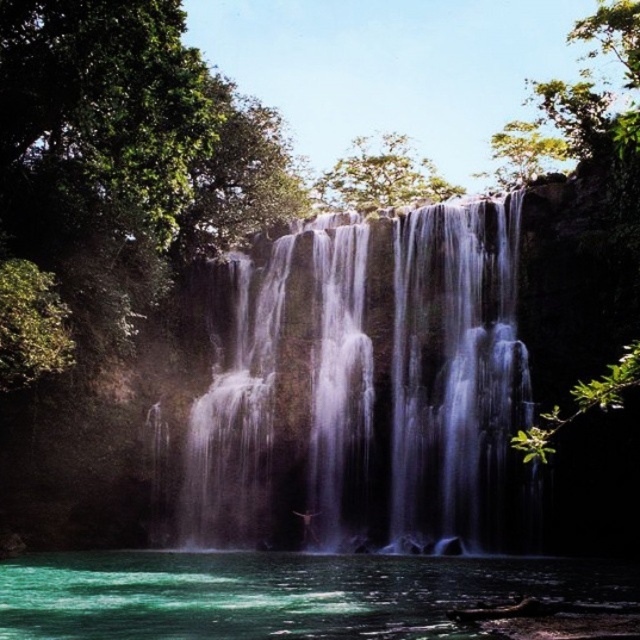
Describe the element at coordinates (358, 394) in the screenshot. I see `white silky waterfall at center` at that location.

Is point (317, 490) positioned behind point (129, 554)?

That is True.

I want to click on white silky waterfall at center, so click(x=358, y=394).

The width and height of the screenshot is (640, 640). What are the coordinates of `white silky waterfall at center` in the screenshot? It's located at (358, 394).

Is green translucent water at lower center below green leafy tree at upper right?

Yes, green translucent water at lower center is below green leafy tree at upper right.

Which is behind, point (250, 560) or point (547, 442)?

The point (250, 560) is more distant.

The height and width of the screenshot is (640, 640). What are the coordinates of `green translucent water at lower center` in the screenshot? It's located at (300, 595).

Where is `green translucent water at lower center`? Image resolution: width=640 pixels, height=640 pixels. green translucent water at lower center is located at coordinates (300, 595).

Does white silky waterfall at center have a greater height compared to green leafy tree at upper right?

No.

Is white silky waterfall at center bigger than green leafy tree at upper right?

No, white silky waterfall at center is not bigger than green leafy tree at upper right.

Image resolution: width=640 pixels, height=640 pixels. Describe the element at coordinates (358, 394) in the screenshot. I see `white silky waterfall at center` at that location.

Find the location of `white silky waterfall at center`. white silky waterfall at center is located at coordinates (358, 394).